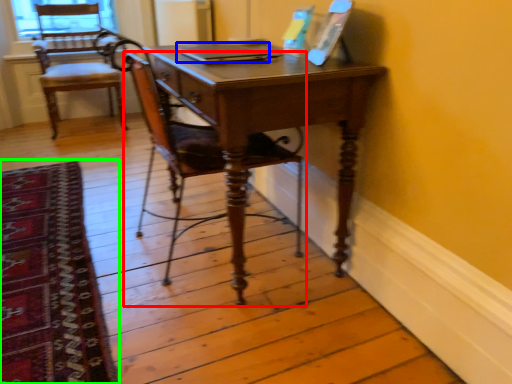
Question: Which object is positioned farthest from chair (highlighted by a red box)? Select from laptop (highlighted by a blue box) and mat (highlighted by a green box).

Choices:
 (A) laptop
 (B) mat

Answer: (B)